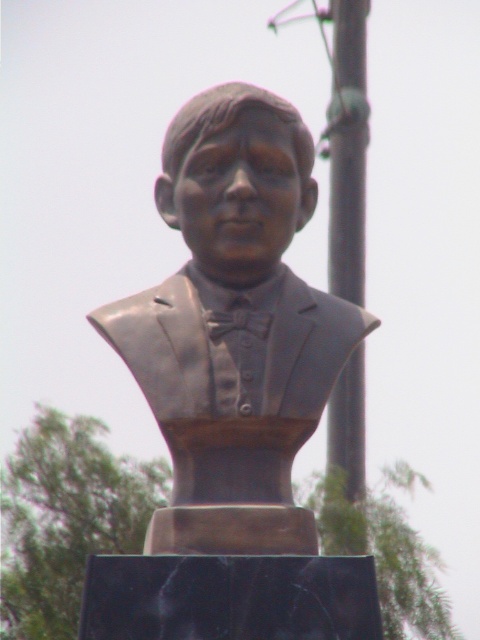
You are an urban planner assessing the space around the bronze statue at center and the smooth metallic pole at center. Based on their widths, which object would require more horizontal space to accommodate in a redesign of the area?

The bronze statue at center might be wider than the smooth metallic pole at center, so it would require more horizontal space in the redesign.

You are a city planner assessing the placement of the bronze statue at center and the smooth metallic pole at center in a public square. Based on their heights, which object would likely require more clearance space when installing?

The smooth metallic pole at center is taller than the bronze statue at center, so it would require more clearance space during installation.